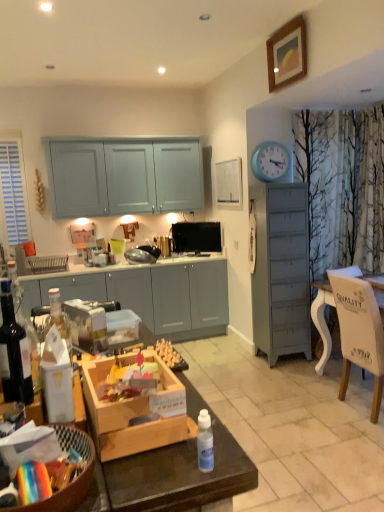
Question: In the image, is wooden corded phone at center positioned in front of or behind translucent glass bottle at left, the 2th bottle in the front-to-back sequence?

Choices:
 (A) front
 (B) behind

Answer: (B)

Question: Is wooden corded phone at center bigger or smaller than translucent glass bottle at left, marked as the 1th bottle in a back-to-front arrangement?

Choices:
 (A) small
 (B) big

Answer: (B)

Question: Estimate the real-world distances between objects in this image. Which object is closer to the satin black toaster at center?

Choices:
 (A) silver metallic toaster at center
 (B) translucent glass bottle at left, the 2th bottle from the right
 (C) blue plastic clock at upper right
 (D) matte gray cabinets at left
 (E) black glossy television at upper center

Answer: (D)

Question: Based on their relative distances, which object is nearer to the wooden picture frame at upper center, arranged as the 2th picture frame when viewed from the left?

Choices:
 (A) translucent glass bottle at left, placed as the second bottle when sorted from bottom to top
 (B) blue plastic clock at upper right
 (C) green glass coffee cup at center
 (D) white wood chair at right
 (E) satin black toaster at center

Answer: (B)